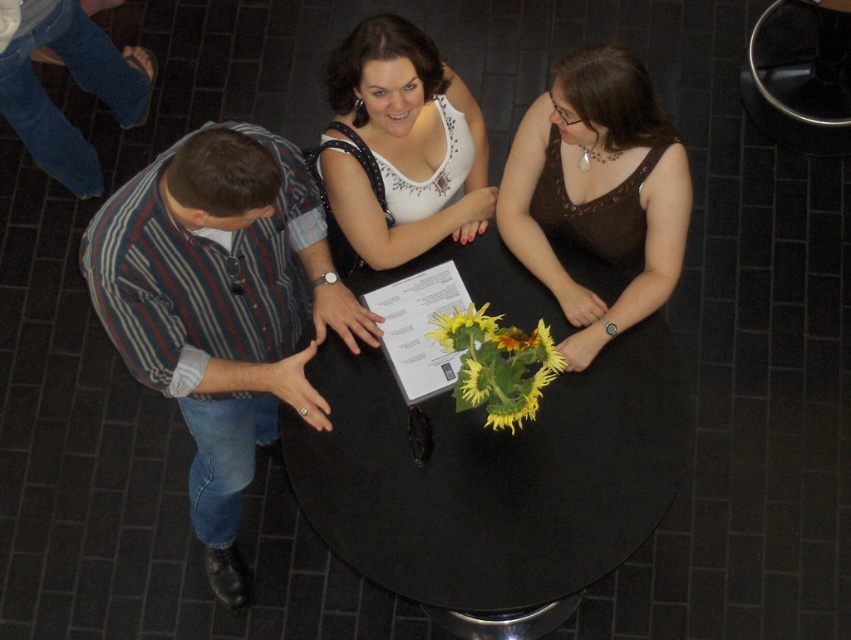
Can you confirm if brown satin tank top at center is thinner than yellow matte sunflowers at center?

No, brown satin tank top at center is not thinner than yellow matte sunflowers at center.

This screenshot has width=851, height=640. Describe the element at coordinates (597, 193) in the screenshot. I see `brown satin tank top at center` at that location.

The height and width of the screenshot is (640, 851). In order to click on brown satin tank top at center in this screenshot , I will do `click(597, 193)`.

Does black matte table at center appear over white sequined top at center?

Actually, black matte table at center is below white sequined top at center.

Does black matte table at center have a lesser height compared to white sequined top at center?

Incorrect, black matte table at center's height does not fall short of white sequined top at center's.

Image resolution: width=851 pixels, height=640 pixels. I want to click on black matte table at center, so point(492,477).

Between black matte table at center and striped cotton shirt at left, which one is positioned lower?

black matte table at center

Is black matte table at center below striped cotton shirt at left?

Indeed, black matte table at center is positioned under striped cotton shirt at left.

Is point (598, 420) positioned in front of point (204, 176)?

No, (598, 420) is behind (204, 176).

Locate an element on the screen. Image resolution: width=851 pixels, height=640 pixels. black matte table at center is located at coordinates (492, 477).